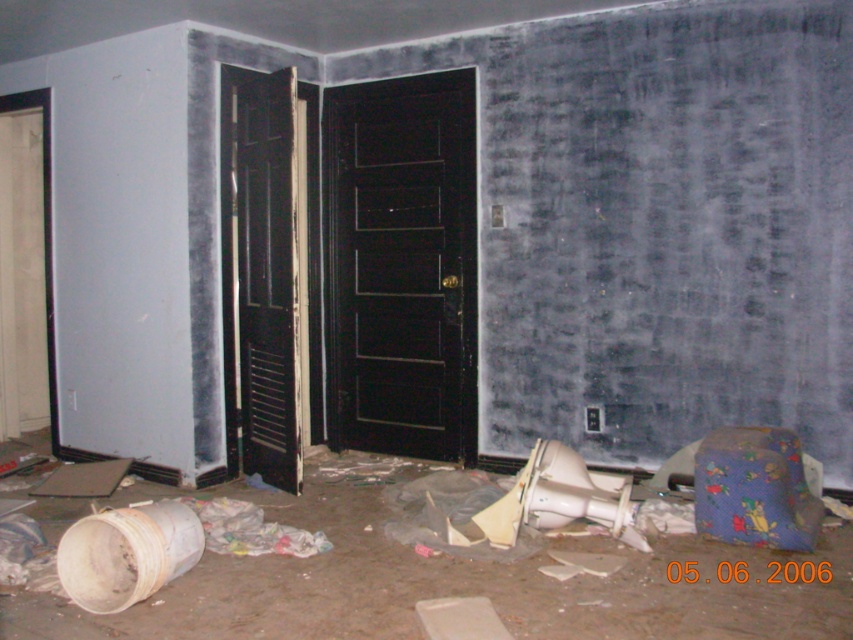
Question: Among these objects, which one is farthest from the camera?

Choices:
 (A) black wooden door at center
 (B) black matte door at center

Answer: (B)

Question: Which object appears closest to the camera in this image?

Choices:
 (A) black matte door at center
 (B) black wooden door at center

Answer: (B)

Question: Is black matte door at center bigger than black wooden door at center?

Choices:
 (A) yes
 (B) no

Answer: (A)

Question: Is black matte door at center to the right of black wooden door at center from the viewer's perspective?

Choices:
 (A) yes
 (B) no

Answer: (A)

Question: Among these points, which one is nearest to the camera?

Choices:
 (A) (415, 93)
 (B) (242, 449)

Answer: (B)

Question: Considering the relative positions of black matte door at center and black wooden door at center in the image provided, where is black matte door at center located with respect to black wooden door at center?

Choices:
 (A) left
 (B) right

Answer: (B)